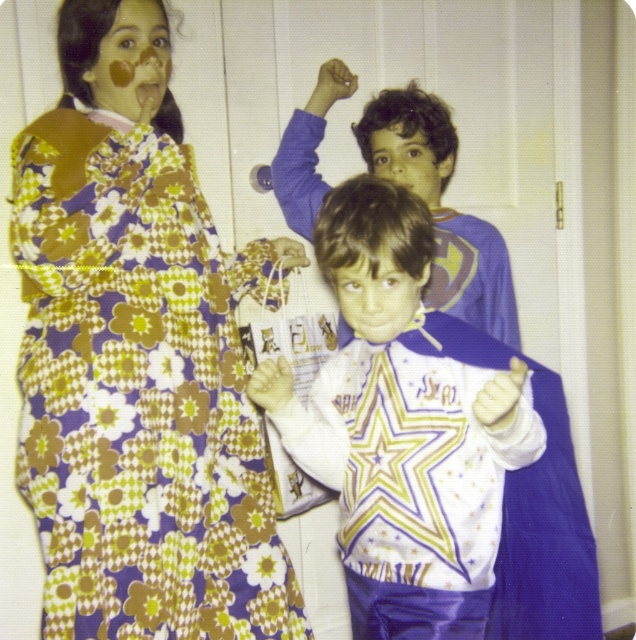
Who is more distant from viewer, (120, 22) or (347, 307)?

The point (120, 22) is behind.

Who is higher up, matte brown face at upper left or smooth white shirt at center?

Positioned higher is matte brown face at upper left.

Image resolution: width=636 pixels, height=640 pixels. What are the coordinates of `matte brown face at upper left` in the screenshot? It's located at (132, 61).

Between point (408, 394) and point (392, 307), which one is positioned behind?

The point (408, 394) is more distant.

Describe the element at coordinates (403, 428) in the screenshot. I see `white satin star at center` at that location.

The image size is (636, 640). What are the coordinates of `white satin star at center` in the screenshot? It's located at (403, 428).

Between point (107, 374) and point (326, 380), which one is positioned behind?

The point (326, 380) is behind.

Is floral fabric dress at upper left taller than white satin star at center?

Yes, floral fabric dress at upper left is taller than white satin star at center.

Does point (120, 630) come in front of point (429, 216)?

That is False.

The width and height of the screenshot is (636, 640). Identify the location of floral fabric dress at upper left. (139, 376).